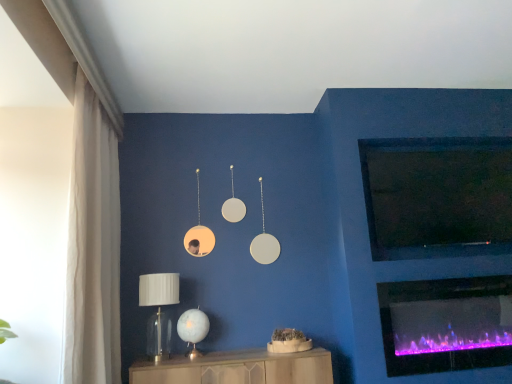
Image resolution: width=512 pixels, height=384 pixels. Describe the element at coordinates (446, 324) in the screenshot. I see `purple electric fireplace at lower right` at that location.

Image resolution: width=512 pixels, height=384 pixels. Describe the element at coordinates (438, 196) in the screenshot. I see `black matte tv at upper right` at that location.

What are the coordinates of `white sheer curtain at left` in the screenshot? It's located at (93, 246).

Locate an element on the screen. The width and height of the screenshot is (512, 384). purple electric fireplace at lower right is located at coordinates (446, 324).

What's the angular difference between purple electric fireplace at lower right and translucent glass table lamp at lower center, the second table lamp from the left,'s facing directions?

They differ by 0.899 degrees in their facing directions.

Considering the sizes of purple electric fireplace at lower right and translucent glass table lamp at lower center, the second table lamp from the left, in the image, is purple electric fireplace at lower right taller or shorter than translucent glass table lamp at lower center, the second table lamp from the left,?

purple electric fireplace at lower right is taller than translucent glass table lamp at lower center, the second table lamp from the left.

Does purple electric fireplace at lower right turn towards translucent glass table lamp at lower center, which appears as the 1th table lamp when viewed from the right?

No, purple electric fireplace at lower right is not turned towards translucent glass table lamp at lower center, which appears as the 1th table lamp when viewed from the right.

Is point (469, 281) farther from viewer compared to point (189, 341)?

Yes.

Is black matte tv at upper right at the left side of translucent glass table lamp at lower center, the second table lamp from the left?

Incorrect, black matte tv at upper right is not on the left side of translucent glass table lamp at lower center, the second table lamp from the left.

From the image's perspective, relative to translucent glass table lamp at lower center, which appears as the 1th table lamp when viewed from the right, is black matte tv at upper right above or below?

From the image's perspective, black matte tv at upper right appears above translucent glass table lamp at lower center, which appears as the 1th table lamp when viewed from the right.

Is point (374, 213) positioned in front of point (191, 323)?

No, it is behind (191, 323).

From the image's perspective, is black matte tv at upper right beneath purple electric fireplace at lower right?

Actually, black matte tv at upper right appears above purple electric fireplace at lower right in the image.

Choose the correct answer: Is black matte tv at upper right inside purple electric fireplace at lower right or outside it?

black matte tv at upper right lies outside purple electric fireplace at lower right.

Is black matte tv at upper right aimed at purple electric fireplace at lower right?

No, black matte tv at upper right is not turned towards purple electric fireplace at lower right.

Based on the photo, measure the distance between black matte tv at upper right and purple electric fireplace at lower right.

The distance of black matte tv at upper right from purple electric fireplace at lower right is 19.68 inches.

From the image's perspective, between wooden cabinet at lower center and black matte tv at upper right, who is located below?

wooden cabinet at lower center appears lower in the image.

Is wooden cabinet at lower center placed right next to black matte tv at upper right?

They are not placed beside each other.

Does wooden cabinet at lower center turn towards black matte tv at upper right?

No.

Which object is thinner, wooden cabinet at lower center or black matte tv at upper right?

With smaller width is black matte tv at upper right.

In terms of size, does black matte tv at upper right appear bigger or smaller than wooden cabinet at lower center?

In the image, black matte tv at upper right appears to be smaller than wooden cabinet at lower center.

Relative to wooden cabinet at lower center, is black matte tv at upper right in front or behind?

black matte tv at upper right is positioned farther from the viewer than wooden cabinet at lower center.

Which of these two, black matte tv at upper right or wooden cabinet at lower center, stands taller?

With more height is black matte tv at upper right.

Which object is positioned more to the right, black matte tv at upper right or wooden cabinet at lower center?

From the viewer's perspective, black matte tv at upper right appears more on the right side.

How distant is clear glass table lamp at lower left, which is the first table lamp from left to right, from wooden cabinet at lower center?

They are 15.64 inches apart.

Is clear glass table lamp at lower left, which is counted as the 2th table lamp, starting from the right, located outside wooden cabinet at lower center?

Indeed, clear glass table lamp at lower left, which is counted as the 2th table lamp, starting from the right, is completely outside wooden cabinet at lower center.

From a real-world perspective, is clear glass table lamp at lower left, which is counted as the 2th table lamp, starting from the right, on wooden cabinet at lower center?

Indeed, from a real-world perspective, clear glass table lamp at lower left, which is counted as the 2th table lamp, starting from the right, stands above wooden cabinet at lower center.

Looking at this image, who is smaller, clear glass table lamp at lower left, which is the first table lamp from left to right, or wooden cabinet at lower center?

Smaller between the two is clear glass table lamp at lower left, which is the first table lamp from left to right.

Can you confirm if purple electric fireplace at lower right is smaller than wooden cabinet at lower center?

Indeed, purple electric fireplace at lower right has a smaller size compared to wooden cabinet at lower center.

Is purple electric fireplace at lower right completely or partially outside of wooden cabinet at lower center?

Yes, purple electric fireplace at lower right is not within wooden cabinet at lower center.

In terms of height, does purple electric fireplace at lower right look taller or shorter compared to wooden cabinet at lower center?

Clearly, purple electric fireplace at lower right is taller compared to wooden cabinet at lower center.

Considering the positions of point (433, 341) and point (219, 367), is point (433, 341) closer or farther from the camera than point (219, 367)?

Point (433, 341).

Where is `table lamp behind the purple electric fireplace at lower right`? This screenshot has width=512, height=384. table lamp behind the purple electric fireplace at lower right is located at coordinates (193, 329).

Image resolution: width=512 pixels, height=384 pixels. I want to click on window screen above the translucent glass table lamp at lower center, which appears as the 1th table lamp when viewed from the right (from a real-world perspective), so click(x=438, y=196).

Which object lies nearer to the anchor point wooden cabinet at lower center, translucent glass table lamp at lower center, the second table lamp from the left, or clear glass table lamp at lower left, which is the first table lamp from left to right?

Among the two, translucent glass table lamp at lower center, the second table lamp from the left, is located nearer to wooden cabinet at lower center.

Based on their spatial positions, is wooden cabinet at lower center or white sheer curtain at left closer to purple electric fireplace at lower right?

The object closer to purple electric fireplace at lower right is wooden cabinet at lower center.

From the image, which object appears to be farther from translucent glass table lamp at lower center, which appears as the 1th table lamp when viewed from the right, black matte tv at upper right or purple electric fireplace at lower right?

Among the two, black matte tv at upper right is located further to translucent glass table lamp at lower center, which appears as the 1th table lamp when viewed from the right.

Estimate the real-world distances between objects in this image. Which object is further from translucent glass table lamp at lower center, which appears as the 1th table lamp when viewed from the right, clear glass table lamp at lower left, which is counted as the 2th table lamp, starting from the right, or white sheer curtain at left?

Among the two, white sheer curtain at left is located further to translucent glass table lamp at lower center, which appears as the 1th table lamp when viewed from the right.

In the scene shown: Which object lies nearer to the anchor point purple electric fireplace at lower right, clear glass table lamp at lower left, which is the first table lamp from left to right, or wooden cabinet at lower center?

wooden cabinet at lower center lies closer to purple electric fireplace at lower right than the other object.

From the image, which object appears to be nearer to translucent glass table lamp at lower center, which appears as the 1th table lamp when viewed from the right, wooden cabinet at lower center or white sheer curtain at left?

wooden cabinet at lower center is positioned closer to the anchor translucent glass table lamp at lower center, which appears as the 1th table lamp when viewed from the right.

Estimate the real-world distances between objects in this image. Which object is closer to clear glass table lamp at lower left, which is counted as the 2th table lamp, starting from the right, purple electric fireplace at lower right or translucent glass table lamp at lower center, the second table lamp from the left?

Based on the image, translucent glass table lamp at lower center, the second table lamp from the left, appears to be nearer to clear glass table lamp at lower left, which is counted as the 2th table lamp, starting from the right.

Based on their spatial positions, is black matte tv at upper right or clear glass table lamp at lower left, which is counted as the 2th table lamp, starting from the right, closer to translucent glass table lamp at lower center, the second table lamp from the left?

clear glass table lamp at lower left, which is counted as the 2th table lamp, starting from the right, is closer to translucent glass table lamp at lower center, the second table lamp from the left.

The image size is (512, 384). In order to click on furniture between translucent glass table lamp at lower center, which appears as the 1th table lamp when viewed from the right, and purple electric fireplace at lower right from left to right in this screenshot , I will do `click(239, 368)`.

I want to click on furniture between white sheer curtain at left and black matte tv at upper right in the horizontal direction, so click(x=239, y=368).

What are the coordinates of `furniture between white sheer curtain at left and purple electric fireplace at lower right from left to right` in the screenshot? It's located at (239, 368).

Locate an element on the screen. The height and width of the screenshot is (384, 512). wood burning stove between clear glass table lamp at lower left, which is the first table lamp from left to right, and black matte tv at upper right, in the horizontal direction is located at coordinates (446, 324).